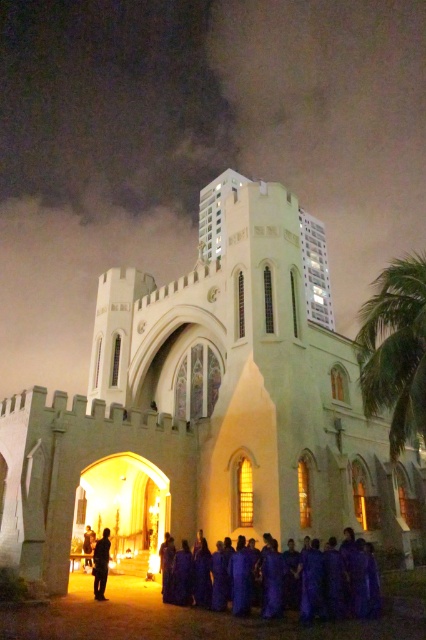
Looking at this image, can you confirm if purple matte dress at center is bigger than green leafy palm tree at right?

Actually, purple matte dress at center might be smaller than green leafy palm tree at right.

Between point (330, 609) and point (406, 355), which one is positioned behind?

Positioned behind is point (406, 355).

You are a GUI agent. You are given a task and a screenshot of the screen. Output one action in this format:
    pyautogui.click(x=<x>, y=<y>)
    Task: Click on the purple matte dress at center
    The height and width of the screenshot is (640, 426).
    Given the screenshot: What is the action you would take?
    pyautogui.click(x=301, y=579)

Does white stone church at center have a lesser height compared to purple matte dress at center?

No, white stone church at center is not shorter than purple matte dress at center.

Is white stone church at center bigger than purple matte dress at center?

Indeed, white stone church at center has a larger size compared to purple matte dress at center.

Between point (175, 492) and point (333, 580), which one is positioned behind?

Point (175, 492)

This screenshot has height=640, width=426. I want to click on white stone church at center, so click(207, 410).

Which is in front, point (158, 515) or point (92, 531)?

Positioned in front is point (92, 531).

Is white stone church at center thinner than purple fabric person at center?

No.

Locate an element on the screen. Image resolution: width=426 pixels, height=640 pixels. white stone church at center is located at coordinates (207, 410).